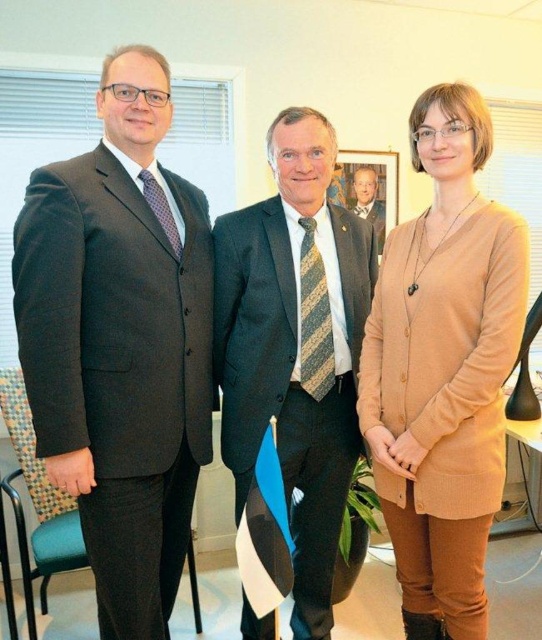
Question: Is beige cardigan at center closer to the viewer compared to wooden picture frame at center?

Choices:
 (A) no
 (B) yes

Answer: (B)

Question: Which of the following is the closest to the observer?

Choices:
 (A) (441, 419)
 (B) (160, 497)
 (C) (377, 241)

Answer: (A)

Question: Can you confirm if beige cardigan at center is positioned below light brown wood tie at center?

Choices:
 (A) no
 (B) yes

Answer: (B)

Question: Estimate the real-world distances between objects in this image. Which object is farther from the light brown wood tie at center?

Choices:
 (A) wooden picture frame at center
 (B) beige cardigan at center

Answer: (B)

Question: Which object is positioned farthest from the wooden picture frame at center?

Choices:
 (A) matte black suit at left
 (B) beige cardigan at center

Answer: (A)

Question: Where is wooden picture frame at center located in relation to light brown wood tie at center in the image?

Choices:
 (A) below
 (B) above

Answer: (B)